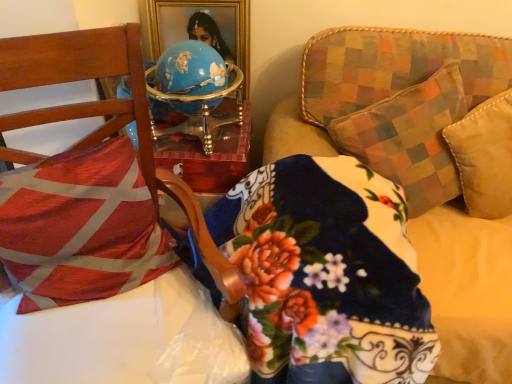
Question: Is fluffy fabric couch at upper right outside red and white fabric pillow at left?

Choices:
 (A) yes
 (B) no

Answer: (A)

Question: Does fluffy fabric couch at upper right have a greater width compared to red and white fabric pillow at left?

Choices:
 (A) yes
 (B) no

Answer: (A)

Question: Is fluffy fabric couch at upper right not near red and white fabric pillow at left?

Choices:
 (A) yes
 (B) no

Answer: (B)

Question: Is fluffy fabric couch at upper right facing towards red and white fabric pillow at left?

Choices:
 (A) yes
 (B) no

Answer: (B)

Question: Does fluffy fabric couch at upper right lie behind red and white fabric pillow at left?

Choices:
 (A) yes
 (B) no

Answer: (B)

Question: Would you say fluffy fabric couch at upper right is inside or outside red and white fabric pillow at left?

Choices:
 (A) outside
 (B) inside

Answer: (A)

Question: Considering the positions of point (503, 89) and point (13, 274), is point (503, 89) closer or farther from the camera than point (13, 274)?

Choices:
 (A) farther
 (B) closer

Answer: (A)

Question: Considering the relative positions of fluffy fabric couch at upper right and red and white fabric pillow at left in the image provided, is fluffy fabric couch at upper right to the left or to the right of red and white fabric pillow at left?

Choices:
 (A) left
 (B) right

Answer: (B)

Question: In the image, is fluffy fabric couch at upper right positioned in front of or behind red and white fabric pillow at left?

Choices:
 (A) front
 (B) behind

Answer: (A)

Question: Is wooden chair at left situated inside red and white fabric pillow at left or outside?

Choices:
 (A) outside
 (B) inside

Answer: (A)

Question: Based on their sizes in the image, would you say wooden chair at left is bigger or smaller than red and white fabric pillow at left?

Choices:
 (A) small
 (B) big

Answer: (B)

Question: Considering the positions of point (74, 54) and point (128, 160), is point (74, 54) closer or farther from the camera than point (128, 160)?

Choices:
 (A) farther
 (B) closer

Answer: (B)

Question: In the image, is wooden chair at left positioned in front of or behind red and white fabric pillow at left?

Choices:
 (A) behind
 (B) front

Answer: (B)

Question: Is wooden chair at left taller or shorter than fluffy fabric couch at upper right?

Choices:
 (A) short
 (B) tall

Answer: (B)

Question: Based on their sizes in the image, would you say wooden chair at left is bigger or smaller than fluffy fabric couch at upper right?

Choices:
 (A) small
 (B) big

Answer: (A)